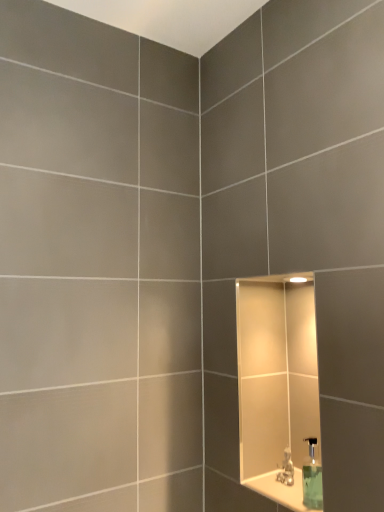
Identify the location of blank space situated above white glossy ledge at lower right (from a real-world perspective). This screenshot has width=384, height=512. (289, 489).